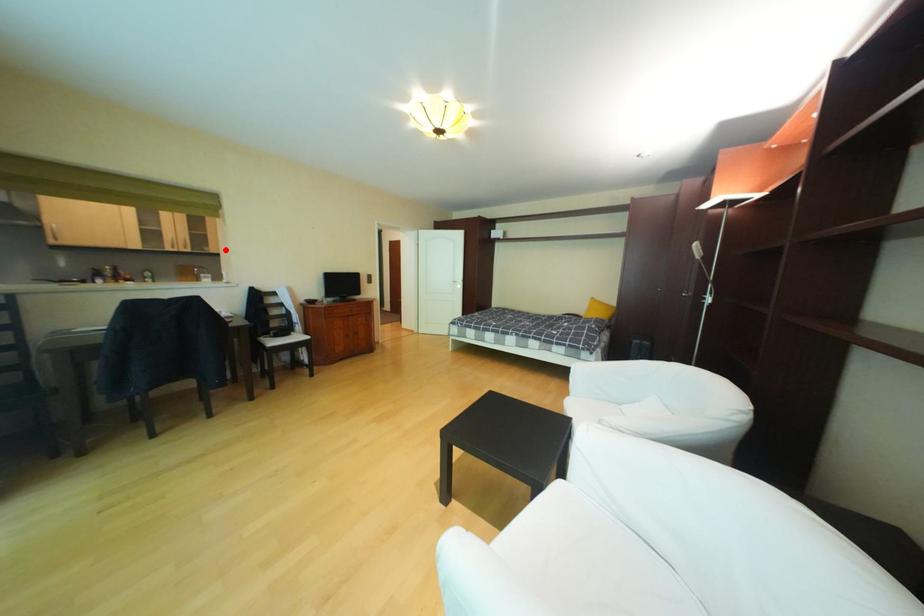
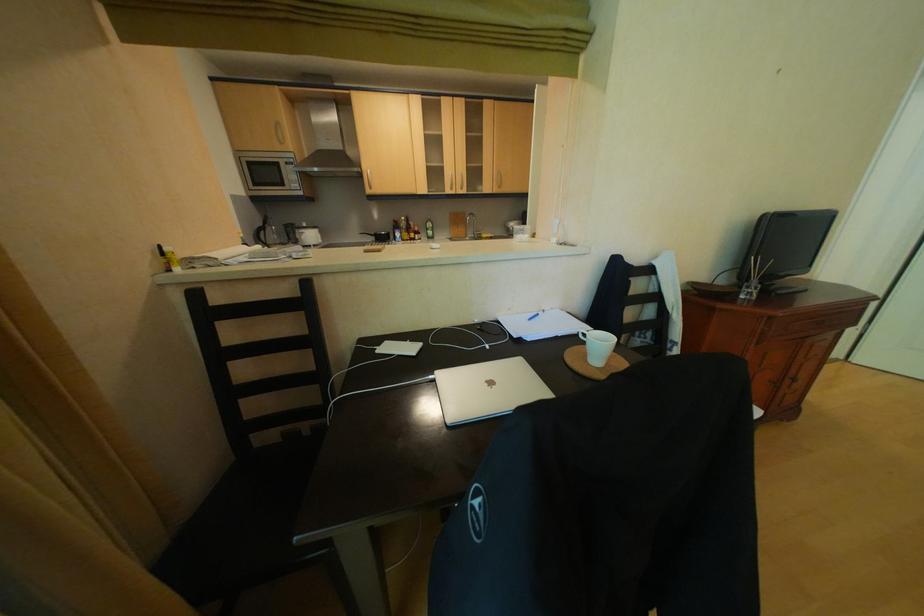
Question: I am providing you with two images of the same scene from different viewpoints. Image1 has a red point marked. In image2, the corresponding 3D location appears at what relative position? Reply with the corresponding letter.

Choices:
 (A) Closer
 (B) Farther

Answer: (A)